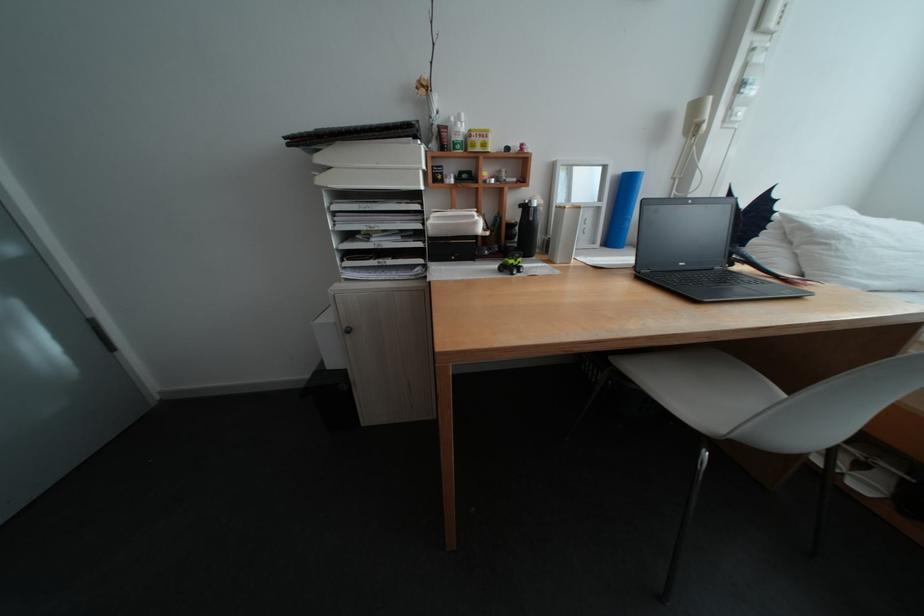
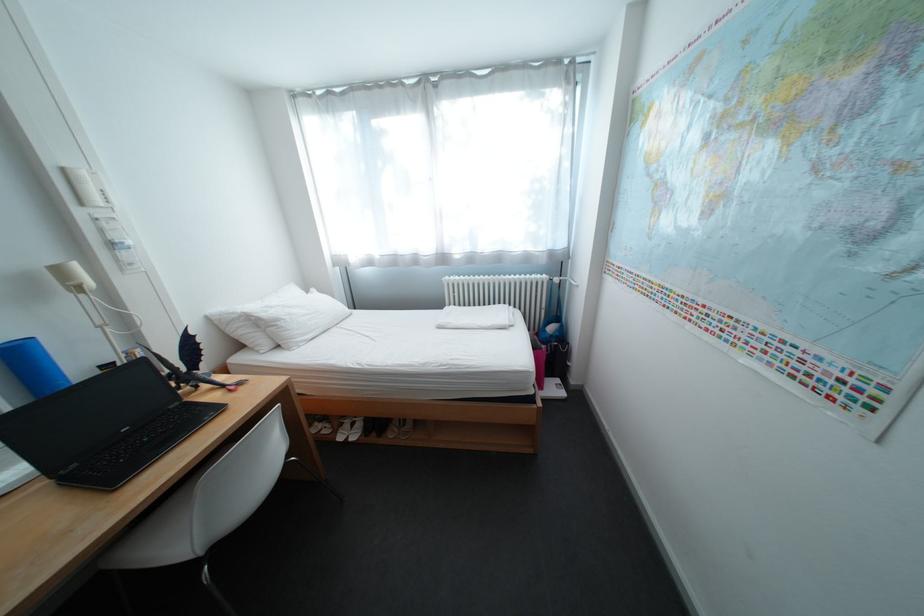
The point at (849, 240) is marked in the first image. Where is the corresponding point in the second image?

(292, 322)